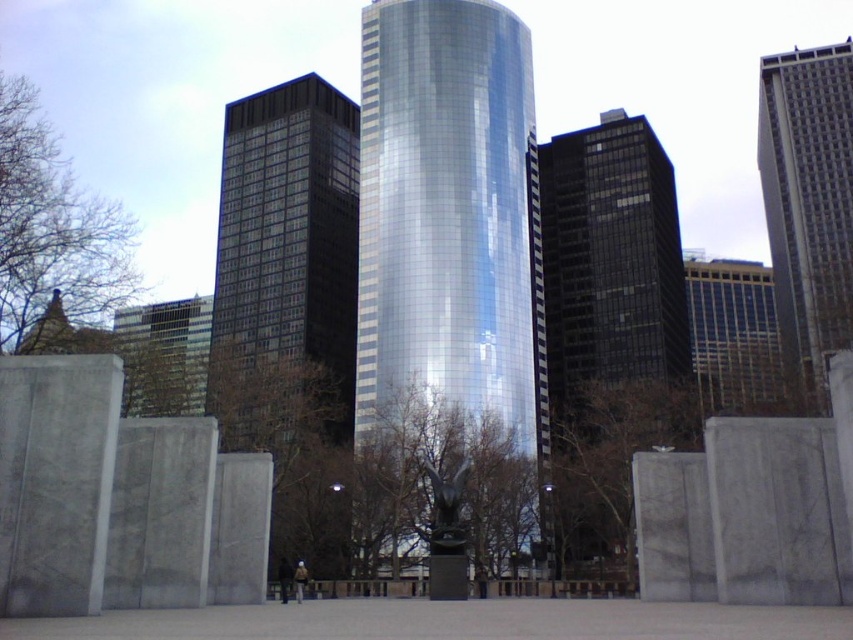
Question: Which of the following is the closest to the observer?

Choices:
 (A) glossy glass skyscraper at center
 (B) gray concrete skyscraper at right

Answer: (A)

Question: Which is farther from the gray concrete skyscraper at right?

Choices:
 (A) matte glass building at center
 (B) glossy glass skyscraper at center
 (C) glossy glass tower at center
 (D) black glass building at center

Answer: (A)

Question: Does glassy reflective skyscraper at right have a greater width compared to matte glass building at center?

Choices:
 (A) no
 (B) yes

Answer: (B)

Question: Is the position of gray concrete skyscraper at right less distant than that of matte glass building at center?

Choices:
 (A) no
 (B) yes

Answer: (A)

Question: Does glassy reflective skyscraper at right appear under matte glass building at center?

Choices:
 (A) yes
 (B) no

Answer: (A)

Question: Which of these objects is positioned closest to the black glass building at center?

Choices:
 (A) glassy reflective skyscraper at right
 (B) glossy glass tower at center
 (C) gray concrete skyscraper at right
 (D) glossy glass skyscraper at center

Answer: (B)